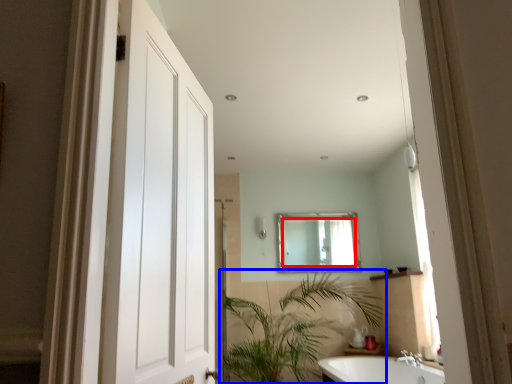
Question: Which object appears closest to the camera in this image, mirror (highlighted by a red box) or houseplant (highlighted by a blue box)?

Choices:
 (A) mirror
 (B) houseplant

Answer: (B)